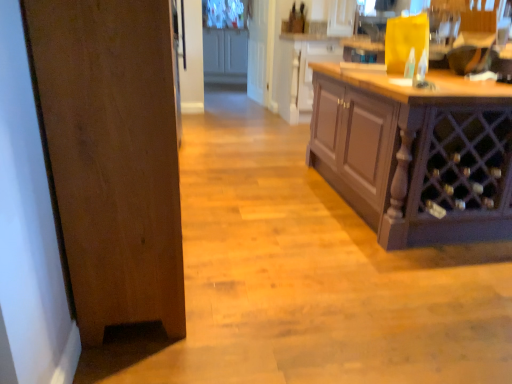
I want to click on vacant space in between wooden door at left and matte wood cabinet at center, arranged as the 2th cabinetry when viewed from the left, so click(253, 176).